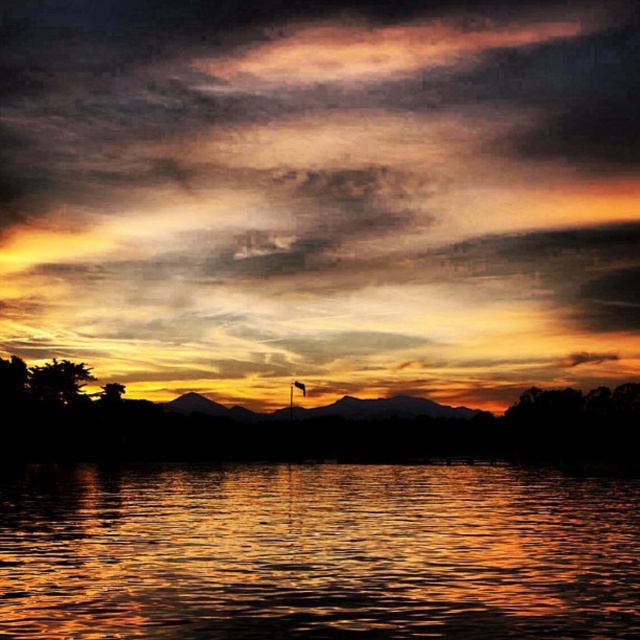
You are standing at the edge of the lake and see two points in the sunset scene. The first point is at coordinates point (540, 211) and the second is at point (536, 611). Which point is closer to you?

Point (540, 211) is further to the camera than point (536, 611), so the point closer to you is point (536, 611).

You are an artist planning to paint the sunset scene. You need to decide which area to focus on first based on their sizes. Which object is taller between the matte orange sky at center and the shiny reflective water at center?

The matte orange sky at center is much taller than the shiny reflective water at center, so you should focus on painting the matte orange sky at center first due to its larger size.